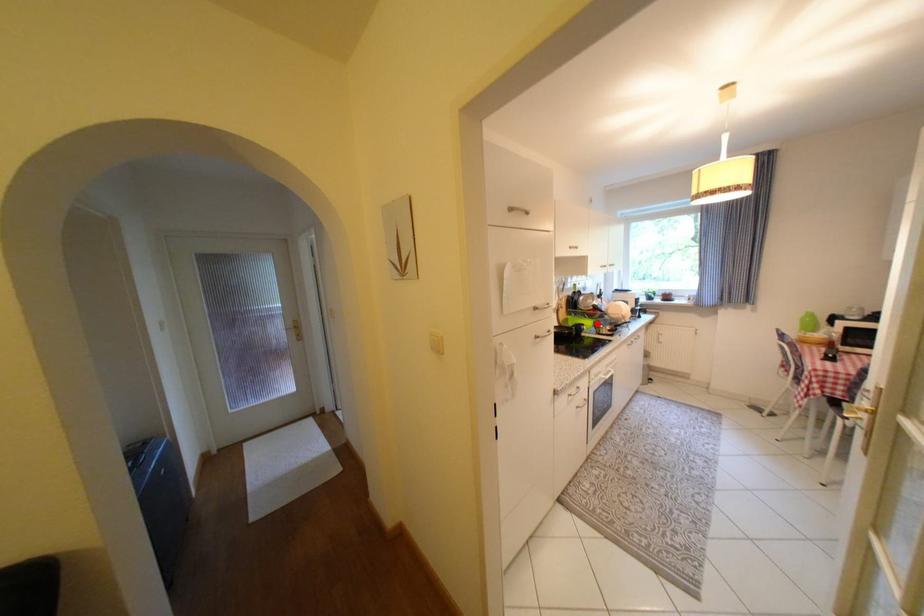
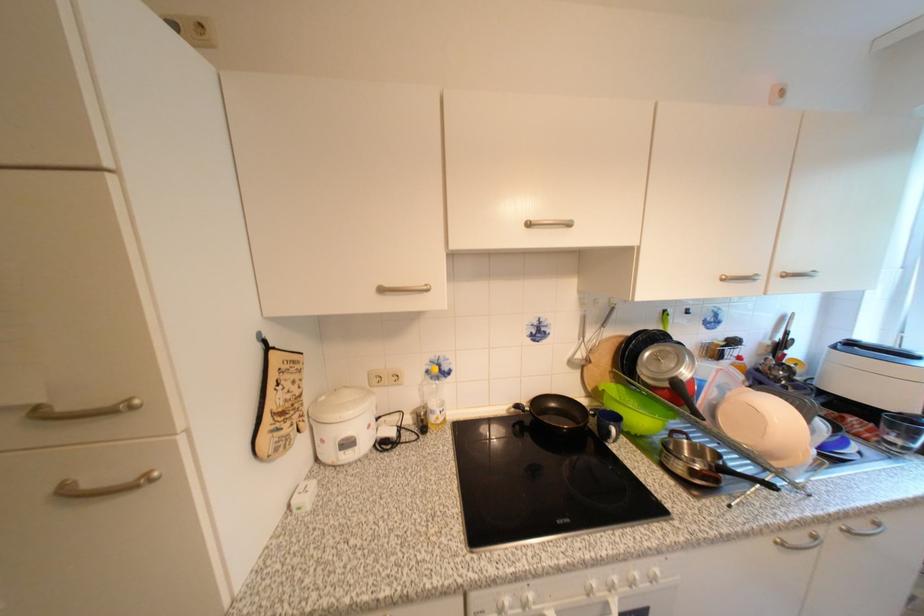
In the second image, find the point that corresponds to the highlighted location in the first image.

(651, 421)